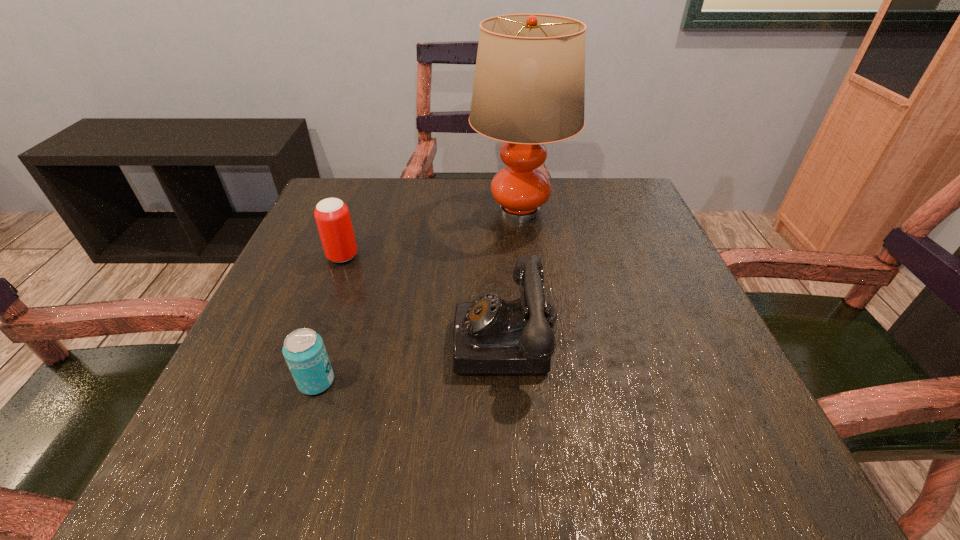
The width and height of the screenshot is (960, 540). I want to click on vacant area situated 0.180m on the dial of the telephone, so click(x=348, y=340).

Locate an element on the screen. The image size is (960, 540). vacant space located 0.120m on the back of the farther beer can is located at coordinates (358, 216).

Identify the location of free space located 0.050m on the right of the nearer beer can. The image size is (960, 540). (367, 381).

Image resolution: width=960 pixels, height=540 pixels. Identify the location of object that is at the far edge. (529, 86).

The width and height of the screenshot is (960, 540). In order to click on free space at the far edge of the desktop in this screenshot , I will do `click(549, 212)`.

The height and width of the screenshot is (540, 960). In the image, there is a desktop. Find the location of `free space at the left edge`. free space at the left edge is located at coordinates (336, 264).

You are a GUI agent. You are given a task and a screenshot of the screen. Output one action in this format:
    pyautogui.click(x=<x>, y=<y>)
    Task: Click on the blank space at the right edge
    This screenshot has height=540, width=960.
    Given the screenshot: What is the action you would take?
    pyautogui.click(x=722, y=350)

Find the location of a particular element. vacant area at the far left corner of the desktop is located at coordinates (361, 181).

Identify the location of vacant space at the near left corner. (287, 440).

In the image, there is a desktop. Identify the location of vacant space at the far right corner. (586, 224).